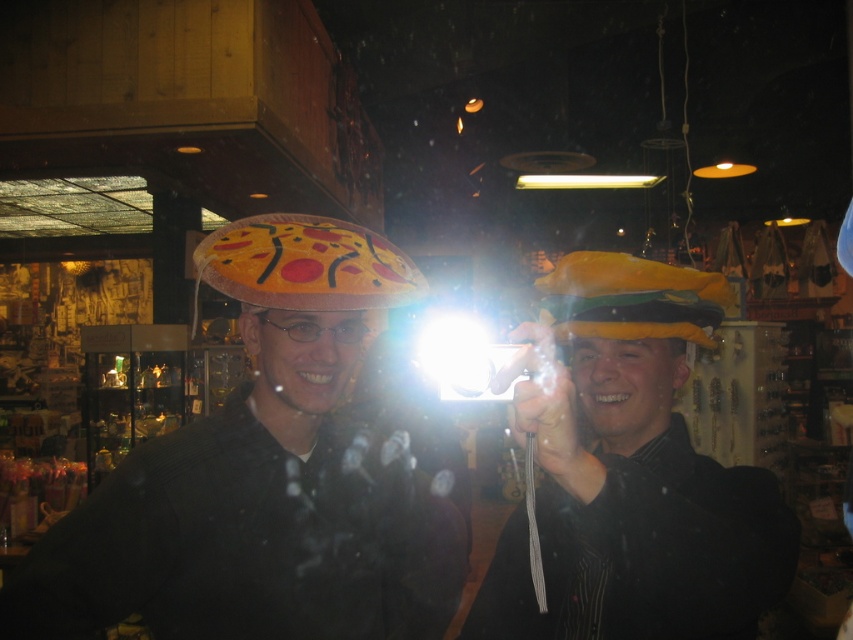
Question: Can you confirm if matte pizza hat at center is wider than yellow fabric hat at right?

Choices:
 (A) yes
 (B) no

Answer: (A)

Question: Is yellow fabric hat at center below felt pizza at center?

Choices:
 (A) no
 (B) yes

Answer: (B)

Question: Is matte pizza hat at center below felt pizza at center?

Choices:
 (A) yes
 (B) no

Answer: (A)

Question: Which point is closer to the camera?

Choices:
 (A) (196, 282)
 (B) (32, 588)

Answer: (B)

Question: Which of the following is the closest to the observer?

Choices:
 (A) (602, 500)
 (B) (389, 433)

Answer: (A)

Question: Which point is farther from the camera taking this photo?

Choices:
 (A) (321, 248)
 (B) (256, 628)

Answer: (A)